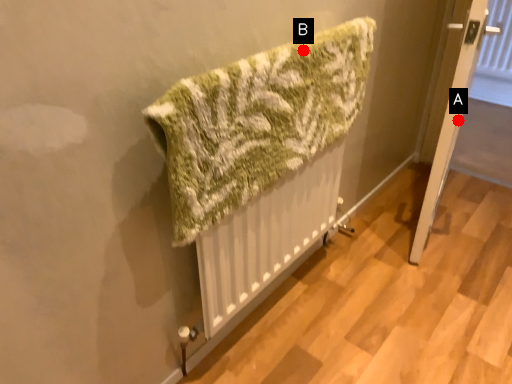
Question: Two points are circled on the image, labeled by A and B beside each circle. Which point appears farthest from the camera in this image?

Choices:
 (A) A is further
 (B) B is further

Answer: (A)